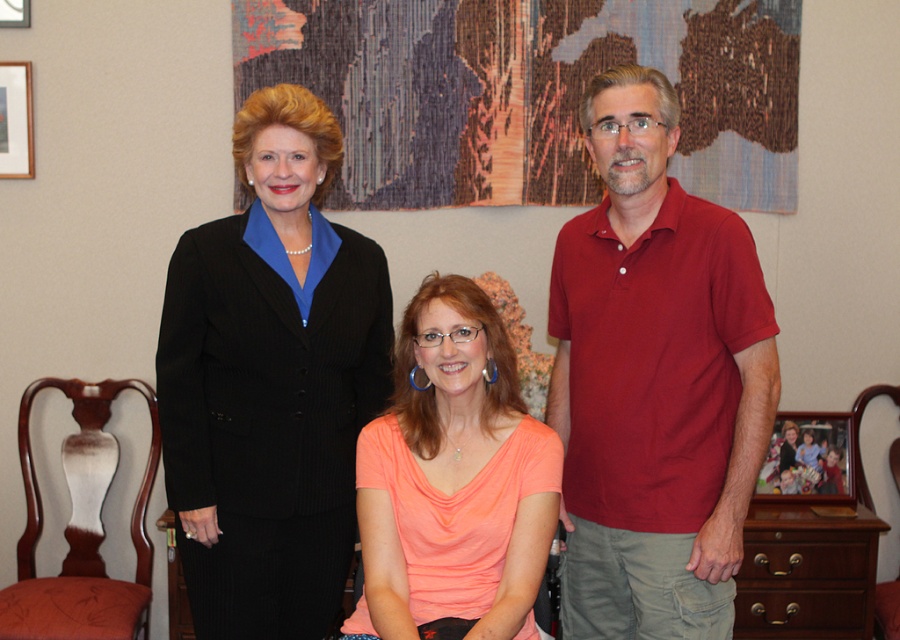
Question: Can you confirm if orange matte shirt at center is positioned to the left of wooden picture frame at center?

Choices:
 (A) no
 (B) yes

Answer: (B)

Question: Which of these objects is positioned farthest from the wooden picture frame at center?

Choices:
 (A) orange matte shirt at center
 (B) matte red polo shirt at center
 (C) brown wood dresser at lower right

Answer: (A)

Question: Considering the relative positions of mahogany wood chair at lower left and wooden picture frame at center in the image provided, where is mahogany wood chair at lower left located with respect to wooden picture frame at center?

Choices:
 (A) right
 (B) left

Answer: (B)

Question: Among these points, which one is farthest from the camera?

Choices:
 (A) (405, 513)
 (B) (302, 534)
 (C) (92, 618)

Answer: (C)

Question: Which object appears farthest from the camera in this image?

Choices:
 (A) mahogany wood chair at lower left
 (B) matte red polo shirt at center
 (C) matte black suit at upper left

Answer: (A)

Question: Is brown wood dresser at lower right to the right of wooden picture frame at center from the viewer's perspective?

Choices:
 (A) no
 (B) yes

Answer: (A)